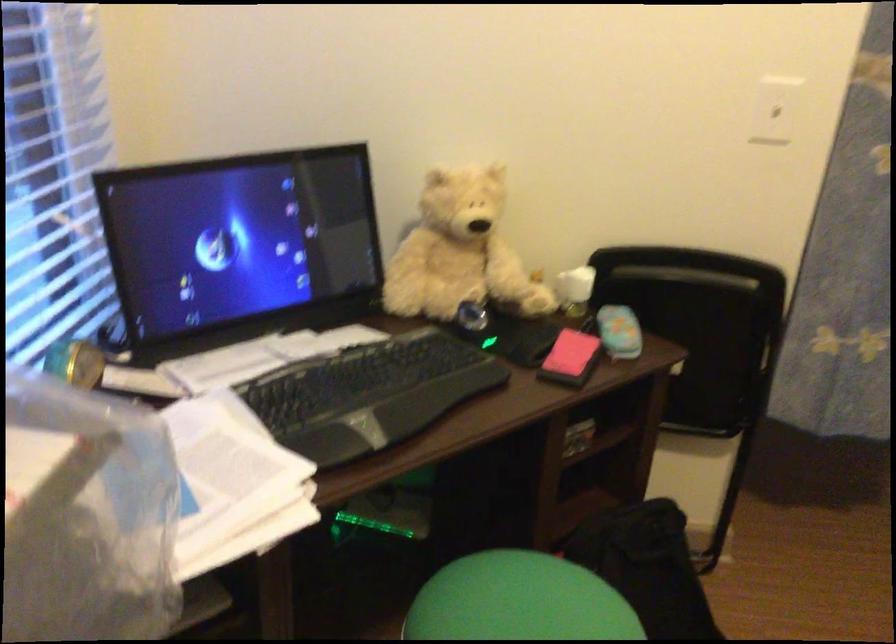
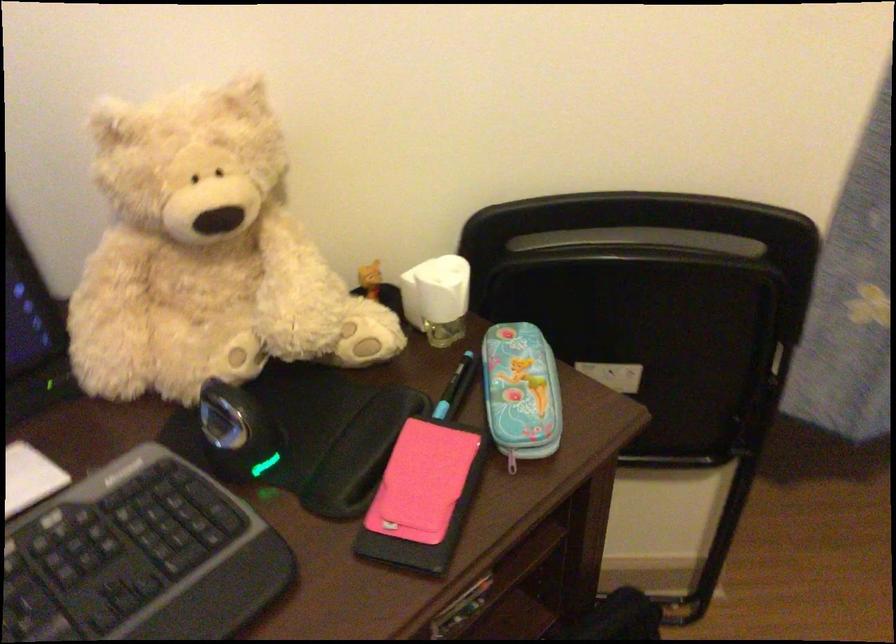
Where in the second image is the point corresponding to pixel 572 350 from the first image?

(421, 482)